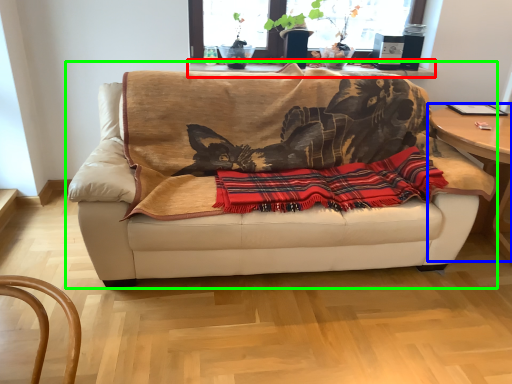
Question: Estimate the real-world distances between objects in this image. Which object is closer to table (highlighted by a red box), table (highlighted by a blue box) or studio couch (highlighted by a green box)?

Choices:
 (A) table
 (B) studio couch

Answer: (B)